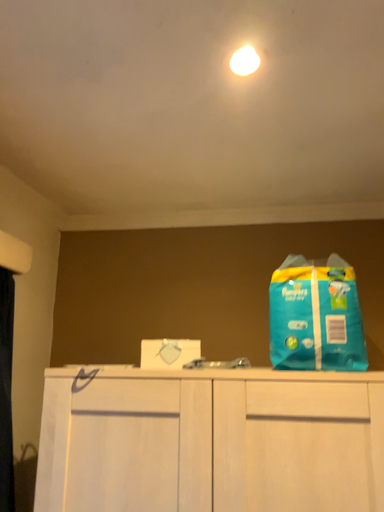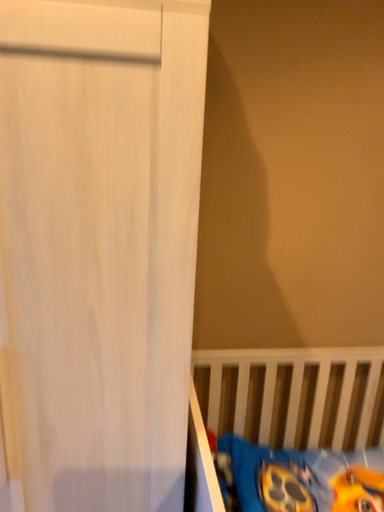
Question: Which way did the camera rotate in the video?

Choices:
 (A) rotated right
 (B) rotated left

Answer: (A)